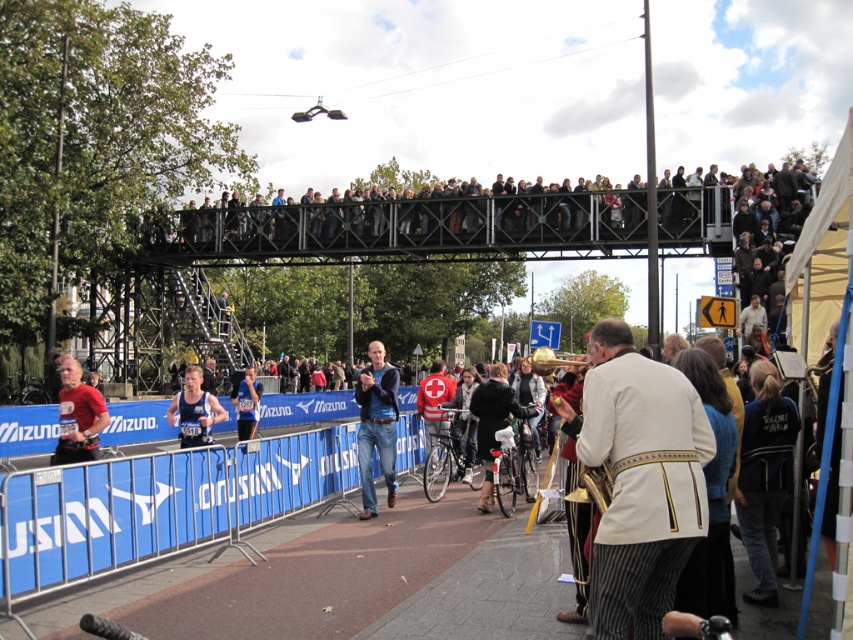
Does blue fabric barrier at lower left have a larger size compared to black jacket at lower right?

Actually, blue fabric barrier at lower left might be smaller than black jacket at lower right.

Can you confirm if blue fabric barrier at lower left is positioned to the right of black jacket at lower right?

No, blue fabric barrier at lower left is not to the right of black jacket at lower right.

Does point (183, 541) come in front of point (753, 452)?

That is False.

Identify the location of blue fabric barrier at lower left. Image resolution: width=853 pixels, height=640 pixels. (161, 506).

Between point (184, 422) and point (236, 436), which one is positioned behind?

Point (236, 436)

Who is more forward, [198,420] or [241,385]?

Positioned in front is point [198,420].

Identify the location of matte blue shirt at center. The width and height of the screenshot is (853, 640). (194, 410).

How distant is blue fabric jacket at center from blue athletic wear at center?

4.92 meters

Is blue fabric jacket at center taller than blue athletic wear at center?

Correct, blue fabric jacket at center is much taller as blue athletic wear at center.

Does point (370, 492) come closer to viewer compared to point (241, 435)?

Yes, it is.

At what (x,y) coordinates should I click in order to perform the action: click on blue fabric jacket at center. Please return your answer as a coordinate pair (x, y). The height and width of the screenshot is (640, 853). Looking at the image, I should click on (376, 426).